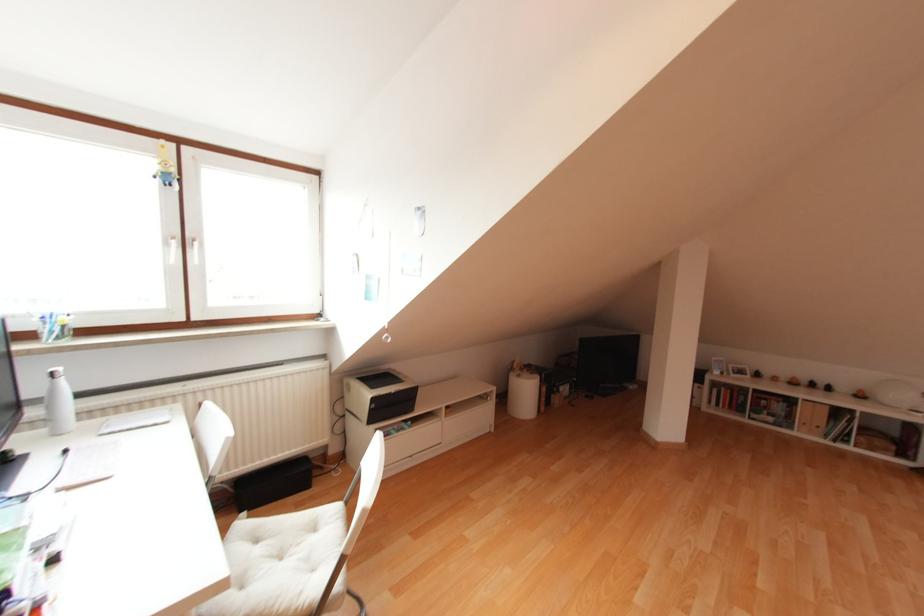
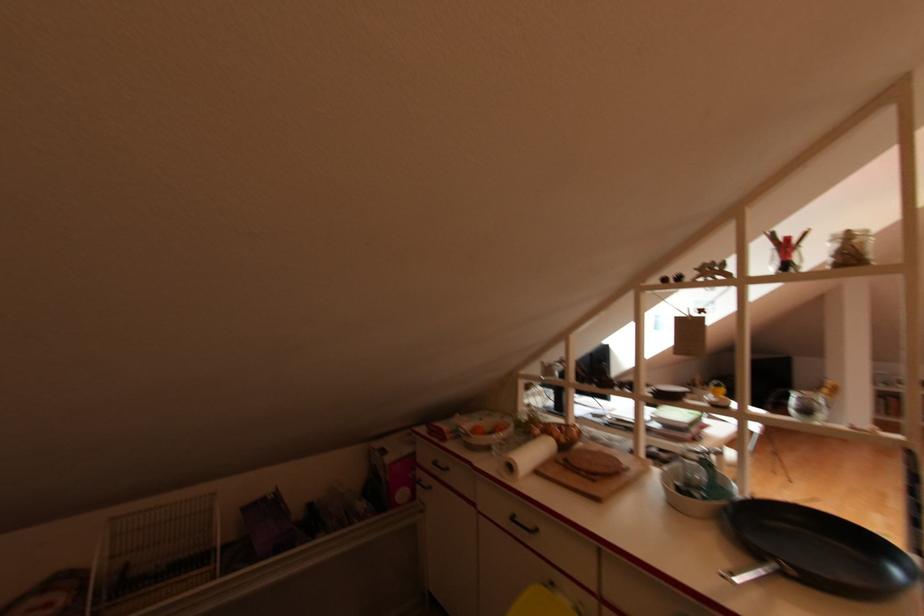
In a continuous first-person perspective shot, in which direction is the camera moving?

The cameraman moved toward left, backward.